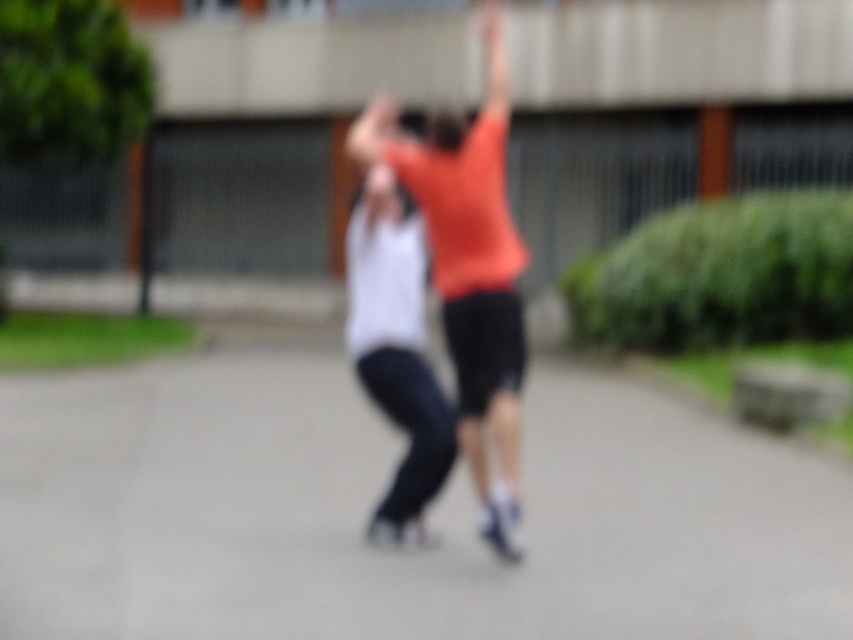
Looking at this image, does gray asphalt pavement at center come behind orange cotton shirt at center?

No, gray asphalt pavement at center is closer to the viewer.

Does point (816, 518) come closer to viewer compared to point (497, 10)?

Yes, it is.

Measure the distance between gray asphalt pavement at center and camera.

21.58 feet

This screenshot has width=853, height=640. In order to click on gray asphalt pavement at center in this screenshot , I will do `click(376, 497)`.

Is orange cotton shirt at center above white matte tank top at center?

Correct, orange cotton shirt at center is located above white matte tank top at center.

The width and height of the screenshot is (853, 640). I want to click on orange cotton shirt at center, so click(x=469, y=269).

Is point (503, 68) positioned in front of point (390, 212)?

No, (503, 68) is further to viewer.

In order to click on orange cotton shirt at center in this screenshot , I will do [469, 269].

Does gray asphalt pavement at center have a greater height compared to white matte tank top at center?

Correct, gray asphalt pavement at center is much taller as white matte tank top at center.

Does gray asphalt pavement at center have a greater width compared to white matte tank top at center?

Correct, the width of gray asphalt pavement at center exceeds that of white matte tank top at center.

Who is more distant from viewer, (445, 515) or (367, 353)?

Positioned behind is point (445, 515).

Identify the location of gray asphalt pavement at center. The height and width of the screenshot is (640, 853). (376, 497).